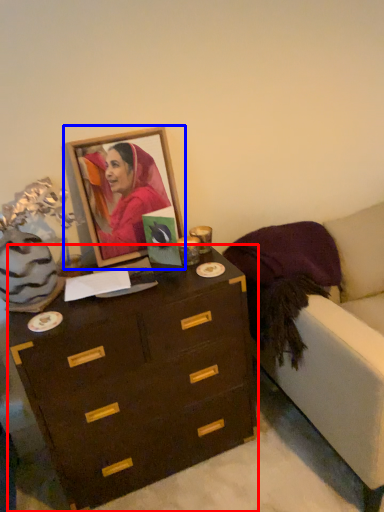
Question: Which of the following is the closest to the observer, chest of drawers (highlighted by a red box) or picture frame (highlighted by a blue box)?

Choices:
 (A) chest of drawers
 (B) picture frame

Answer: (A)